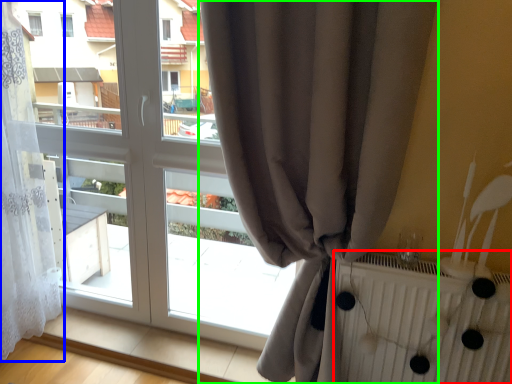
Question: Which object is positioned closest to radiator (highlighted by a red box)? Select from curtain (highlighted by a blue box) and curtain (highlighted by a green box).

Choices:
 (A) curtain
 (B) curtain

Answer: (B)